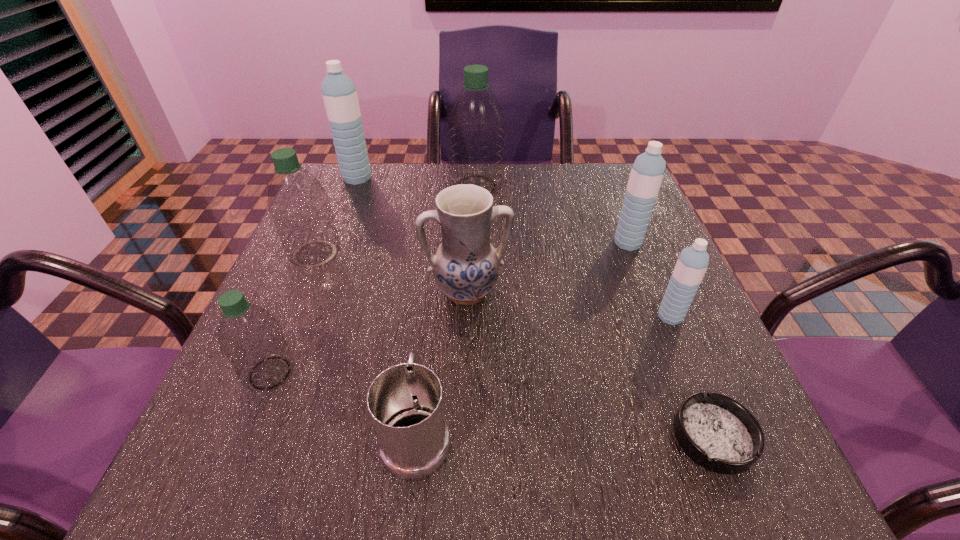
Identify the location of green water bottle that is the third closest to the second smallest blue water bottle. 250,338.

Choose which blue water bottle is the third nearest neighbor to the ashtray. Please provide its 2D coordinates. Your answer should be formatted as a tuple, i.e. [(x, y)], where the tuple contains the x and y coordinates of a point satisfying the conditions above.

[(339, 94)]

Locate an element on the screen. blue water bottle object that ranks as the second closest to the nearest blue water bottle is located at coordinates (339, 94).

The height and width of the screenshot is (540, 960). In order to click on vacant point that satisfies the following two spatial constraints: 1. on the back side of the nearest green water bottle; 2. on the left side of the leftmost blue water bottle in this screenshot , I will do `click(350, 178)`.